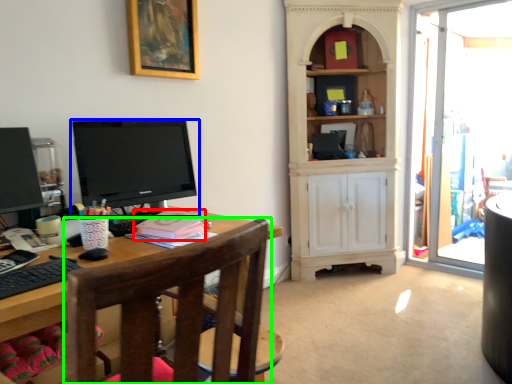
Question: Based on their relative distances, which object is nearer to book (highlighted by a red box)? Choose from television (highlighted by a blue box) and chair (highlighted by a green box).

Choices:
 (A) television
 (B) chair

Answer: (A)